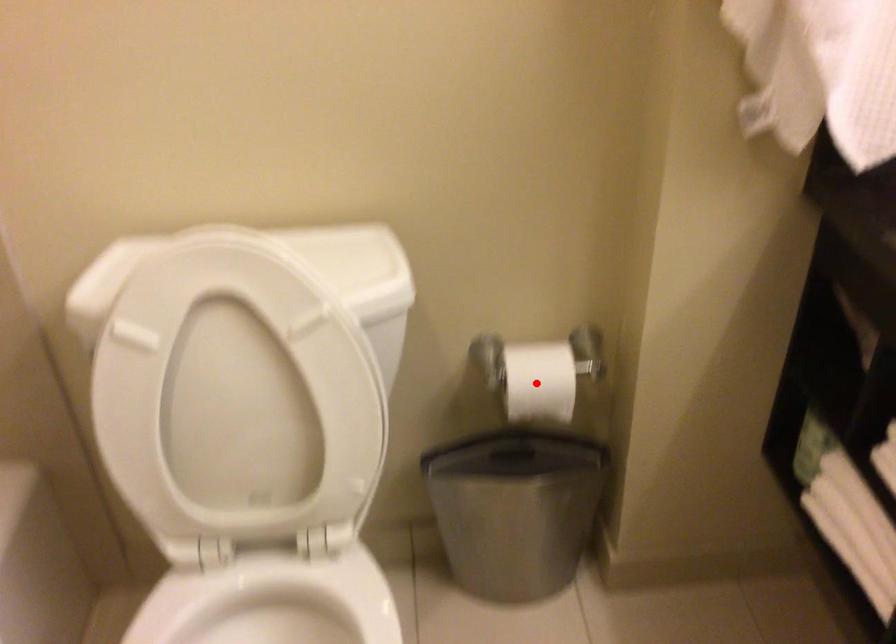
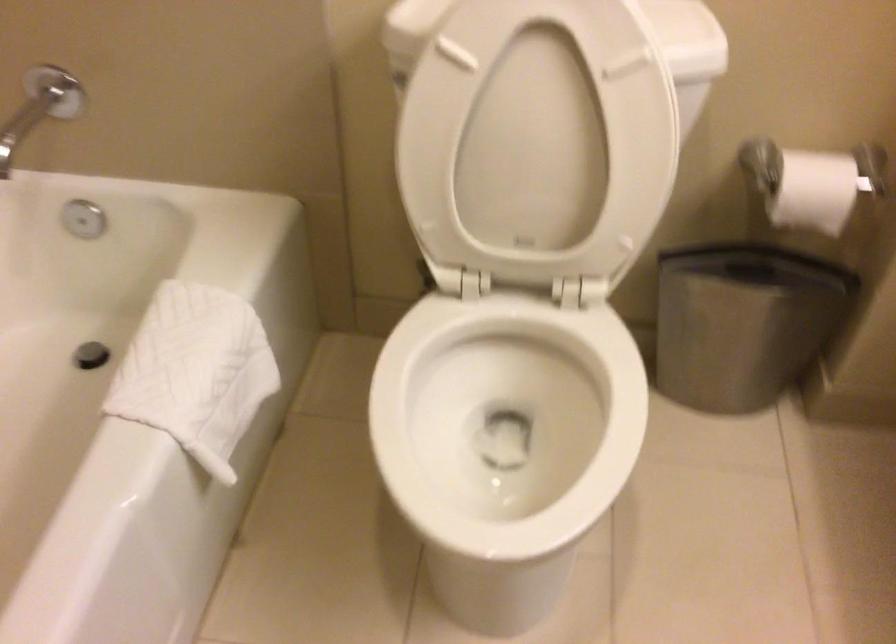
Where in the second image is the point corresponding to the highlighted location from the first image?

(812, 183)